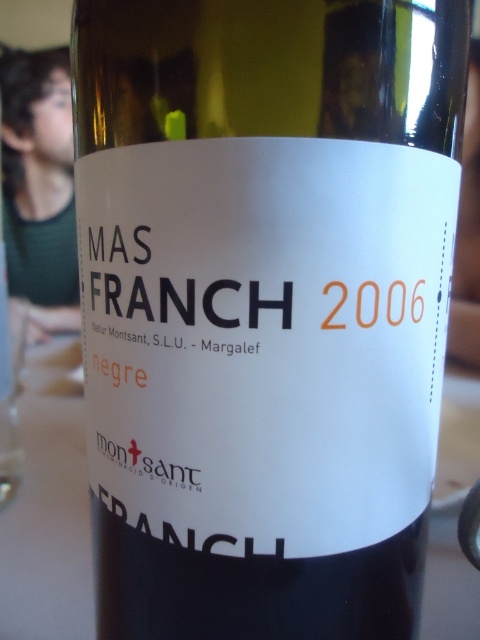
Question: Which of the following is the farthest from the observer?

Choices:
 (A) (60, 129)
 (B) (3, 509)

Answer: (A)

Question: Can you confirm if white paper label at center is wider than green knitted sweater at left?

Choices:
 (A) no
 (B) yes

Answer: (B)

Question: In this image, where is white paper label at center located relative to green knitted sweater at left?

Choices:
 (A) right
 (B) left

Answer: (A)

Question: Can you confirm if white paper label at center is positioned to the left of green knitted sweater at left?

Choices:
 (A) yes
 (B) no

Answer: (B)